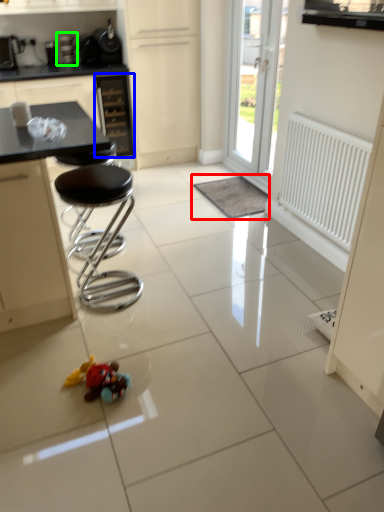
Question: Which object is the closest to the wide (highlighted by a red box)? Choose among these: drawer (highlighted by a blue box) or appliance (highlighted by a green box).

Choices:
 (A) drawer
 (B) appliance

Answer: (A)